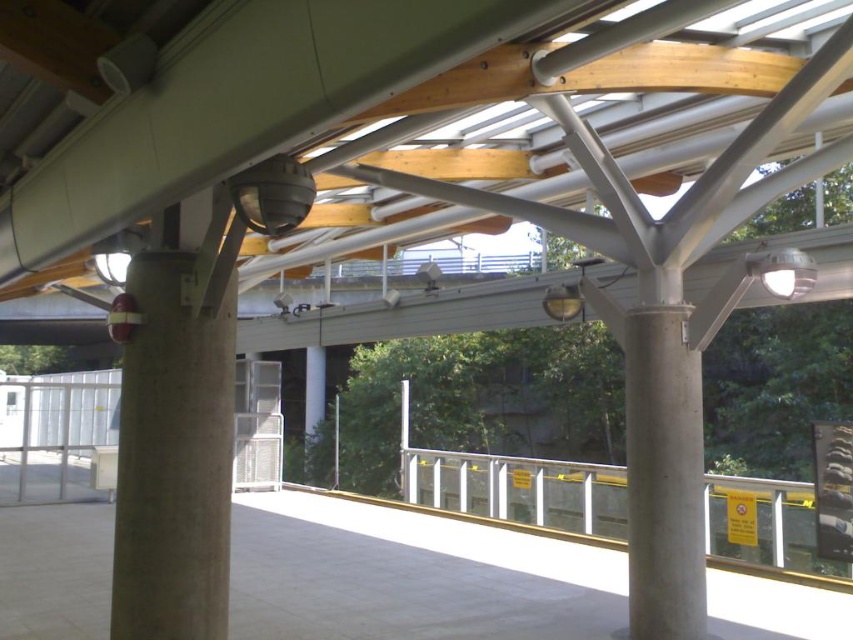
You are a maintenance worker standing at the entrance of the walkway. You need to inspect both the concrete at left and the white concrete pillar at center. Which object should you check first if you want to start with the one closer to your current position?

The concrete at left is in front of the white concrete pillar at center, so you should check the concrete at left first since it is closer to your current position.

You are standing on the walkway and want to move from the point at coordinates point (138, 618) to the point at coordinates point (628, 324). Which direction should you face to walk towards the second point?

Since point (138, 618) is in front of point (628, 324), you should face backward to walk towards point (628, 324).

You are standing on the walkway and want to move from the concrete at left to the white concrete pillar at center. Which direction should you move to reach the pillar?

You should move to the right to reach the white concrete pillar at center from the concrete at left since the pillar is positioned to the right of the concrete at left.